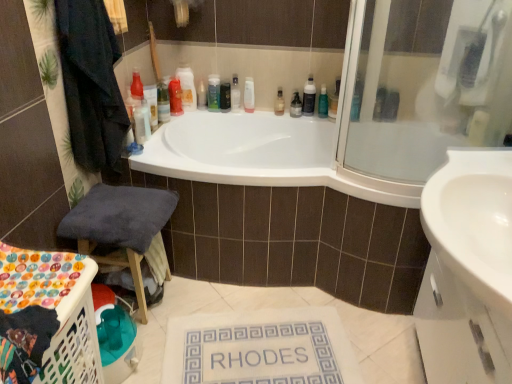
Question: Would you say white plastic laundry basket at lower left is part of translucent plastic bottle at upper center, which is the tenth toiletry in right-to-left order,'s contents?

Choices:
 (A) yes
 (B) no

Answer: (B)

Question: From a real-world perspective, is translucent plastic bottle at upper center, which is the tenth toiletry in right-to-left order, located beneath white plastic laundry basket at lower left?

Choices:
 (A) no
 (B) yes

Answer: (A)

Question: Does translucent plastic bottle at upper center, acting as the first toiletry starting from the left, appear on the right side of white plastic laundry basket at lower left?

Choices:
 (A) no
 (B) yes

Answer: (B)

Question: Is translucent plastic bottle at upper center, acting as the first toiletry starting from the left, positioned before white plastic laundry basket at lower left?

Choices:
 (A) no
 (B) yes

Answer: (A)

Question: Can you confirm if translucent plastic bottle at upper center, which is the tenth toiletry in right-to-left order, is positioned to the left of white plastic laundry basket at lower left?

Choices:
 (A) no
 (B) yes

Answer: (A)

Question: Is matte plastic bottle at upper center, which is the first toiletry in right-to-left order, situated inside matte plastic container at upper center, the ninth toiletry when ordered from right to left, or outside?

Choices:
 (A) inside
 (B) outside

Answer: (B)

Question: Visually, is matte plastic bottle at upper center, which is the tenth toiletry from left to right, positioned to the left or to the right of matte plastic container at upper center, the second toiletry when ordered from left to right?

Choices:
 (A) right
 (B) left

Answer: (A)

Question: Considering the positions of matte plastic bottle at upper center, which is the first toiletry in right-to-left order, and matte plastic container at upper center, the ninth toiletry when ordered from right to left, in the image, is matte plastic bottle at upper center, which is the first toiletry in right-to-left order, bigger or smaller than matte plastic container at upper center, the ninth toiletry when ordered from right to left,?

Choices:
 (A) small
 (B) big

Answer: (A)

Question: Is matte plastic bottle at upper center, which is the first toiletry in right-to-left order, wider or thinner than matte plastic container at upper center, the second toiletry when ordered from left to right?

Choices:
 (A) thin
 (B) wide

Answer: (A)

Question: Looking at their shapes, would you say white plastic laundry basket at lower left is wider or thinner than blue glass bottle at upper center, which is the 3th toiletry in right-to-left order?

Choices:
 (A) thin
 (B) wide

Answer: (B)

Question: Considering the positions of white plastic laundry basket at lower left and blue glass bottle at upper center, the 8th toiletry viewed from the left, in the image, is white plastic laundry basket at lower left taller or shorter than blue glass bottle at upper center, the 8th toiletry viewed from the left,?

Choices:
 (A) tall
 (B) short

Answer: (A)

Question: Is white plastic laundry basket at lower left in front of or behind blue glass bottle at upper center, which is the 3th toiletry in right-to-left order, in the image?

Choices:
 (A) front
 (B) behind

Answer: (A)

Question: Looking at the image, does white plastic laundry basket at lower left seem bigger or smaller compared to blue glass bottle at upper center, the 8th toiletry viewed from the left?

Choices:
 (A) small
 (B) big

Answer: (B)

Question: In the image, is white plastic laundry basket at lower left positioned in front of or behind matte plastic bottle at upper center, the 9th toiletry when ordered from left to right?

Choices:
 (A) behind
 (B) front

Answer: (B)

Question: Is white plastic laundry basket at lower left wider or thinner than matte plastic bottle at upper center, the second toiletry from the right?

Choices:
 (A) thin
 (B) wide

Answer: (B)